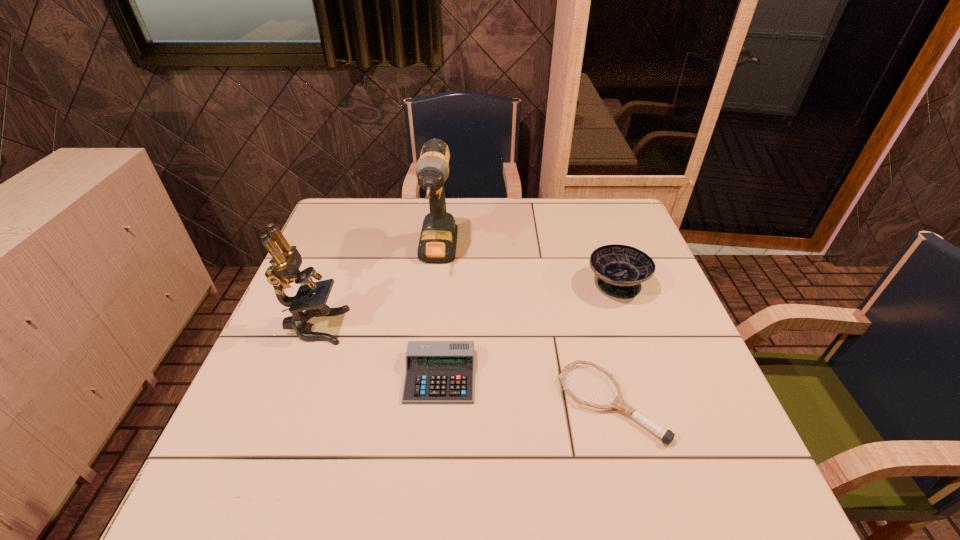
Where is `vacant space situated 0.180m on the back of the shortest object`? The height and width of the screenshot is (540, 960). vacant space situated 0.180m on the back of the shortest object is located at coordinates (586, 307).

The height and width of the screenshot is (540, 960). I want to click on object situated at the far edge, so click(x=438, y=239).

You are a GUI agent. You are given a task and a screenshot of the screen. Output one action in this format:
    pyautogui.click(x=<x>, y=<y>)
    Task: Click on the object positioned at the left edge
    The height and width of the screenshot is (540, 960).
    Given the screenshot: What is the action you would take?
    pyautogui.click(x=285, y=266)

Locate an element on the screen. The height and width of the screenshot is (540, 960). bowl present at the right edge is located at coordinates (621, 269).

At what (x,y) coordinates should I click in order to perform the action: click on tennis racket that is at the right edge. Please return your answer as a coordinate pair (x, y). The image size is (960, 540). Looking at the image, I should click on (667, 436).

Where is `free space at the far edge`? The height and width of the screenshot is (540, 960). free space at the far edge is located at coordinates point(503,208).

In order to click on vacant region at the left edge of the desktop in this screenshot , I will do `click(343, 287)`.

Locate an element on the screen. vacant region at the right edge of the desktop is located at coordinates (641, 244).

The image size is (960, 540). I want to click on vacant area at the far right corner of the desktop, so click(625, 200).

The width and height of the screenshot is (960, 540). I want to click on free space between the third shortest object and the shortest object, so click(613, 343).